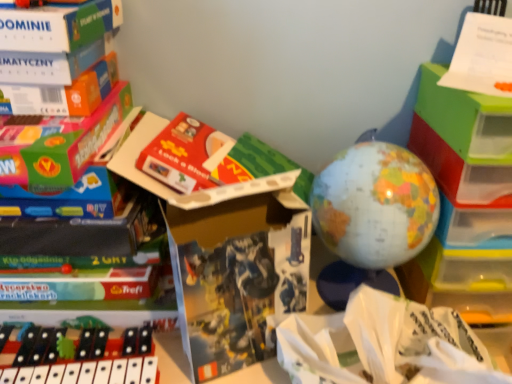
Question: Considering their positions, is white paper at center located in front of or behind matte cardboard book at center?

Choices:
 (A) behind
 (B) front

Answer: (A)

Question: Considering the positions of white paper at center and matte cardboard book at center in the image, is white paper at center taller or shorter than matte cardboard book at center?

Choices:
 (A) short
 (B) tall

Answer: (A)

Question: Which of these objects is positioned closest to the black plastic xylophone at lower left, placed as the second toy when sorted from right to left?

Choices:
 (A) matte cardboard book at center
 (B) white paper at center
 (C) matte plastic globe at center, which is counted as the second toy, starting from the bottom

Answer: (A)

Question: Estimate the real-world distances between objects in this image. Which object is closer to the black plastic xylophone at lower left, the first toy when ordered from bottom to top?

Choices:
 (A) white paper at center
 (B) matte cardboard book at center
 (C) matte plastic globe at center, the 1th toy from the top

Answer: (B)